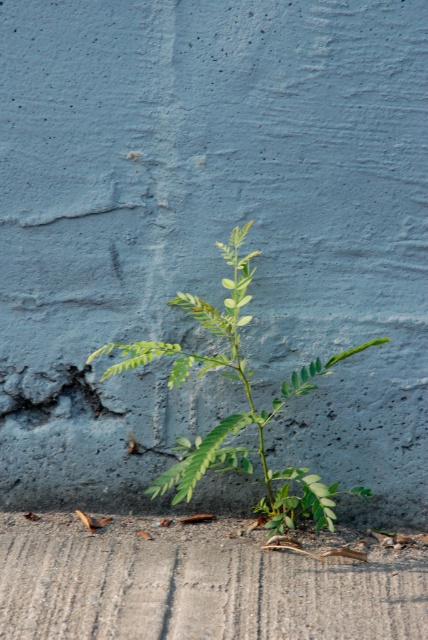
Can you confirm if gray concrete at bottom is smaller than green leafy plant at center?

Yes.

Is gray concrete at bottom thinner than green leafy plant at center?

Incorrect, gray concrete at bottom's width is not less than green leafy plant at center's.

Where is `gray concrete at bottom`? Image resolution: width=428 pixels, height=640 pixels. gray concrete at bottom is located at coordinates [196, 586].